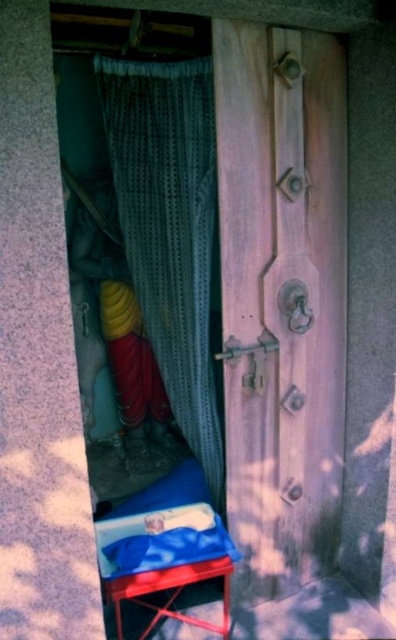
You are trying to move the metallic red stool at lower center through the wooden door at center. Can the stool fit through the door without being moved or adjusted?

The wooden door at center is wider than the metallic red stool at lower center, so the stool can fit through the door without needing to be moved or adjusted.

You are standing in front of the partially open wooden door and want to enter the alcove. There is a textured fabric curtain at center and a metallic red stool at lower center. Which object is blocking your path to the stool?

The textured fabric curtain at center is positioned over metallic red stool at lower center, meaning the curtain is blocking the path to the stool.

You are standing in front of the door and want to touch both points on the door. Which point should you reach for first, point (331, 432) or point (201, 579)?

You should reach for point (331, 432) first because it is closer to you than point (201, 579).